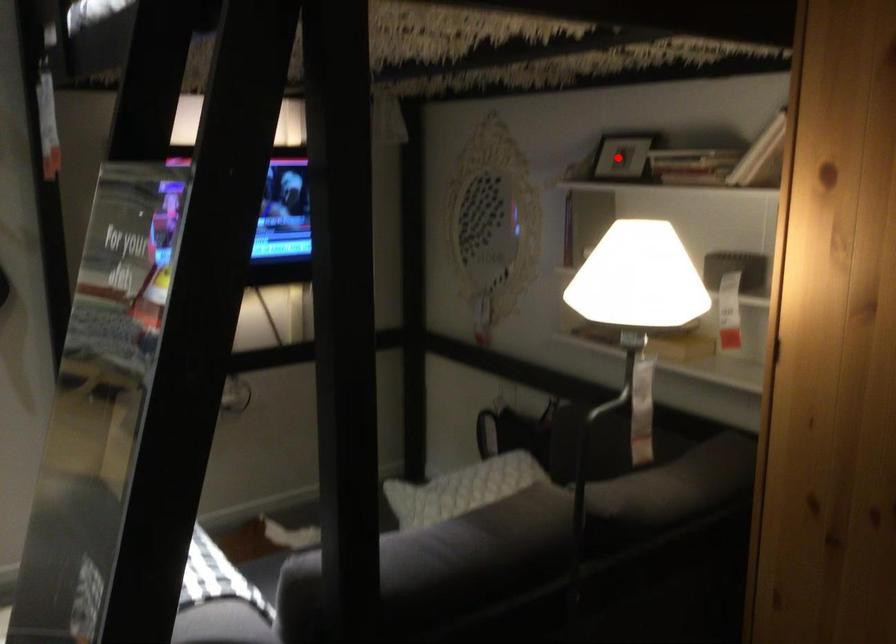
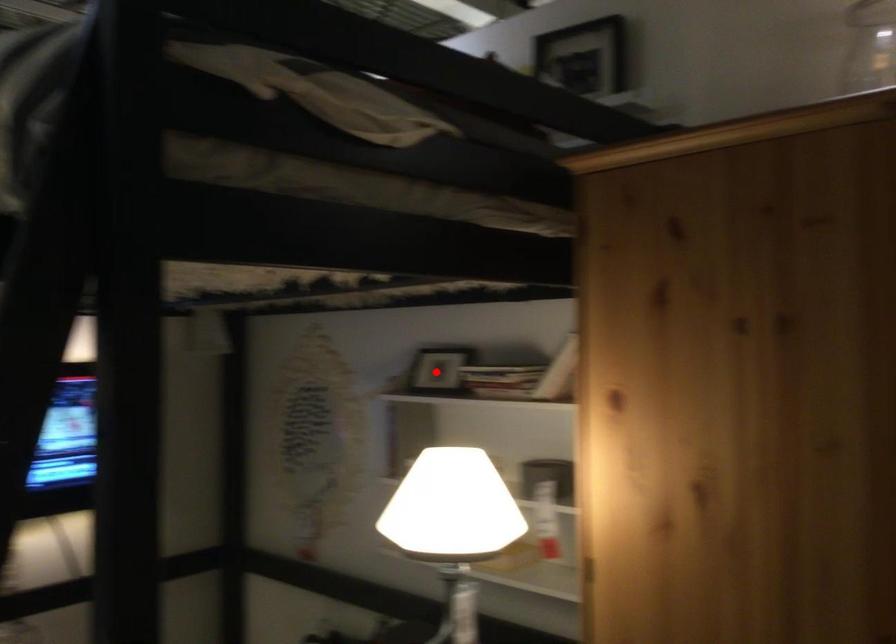
I am providing you with two images of the same scene from different viewpoints. A red point is marked on the first image and another point is marked on the second image. Do the highlighted points in image1 and image2 indicate the same real-world spot?

Yes